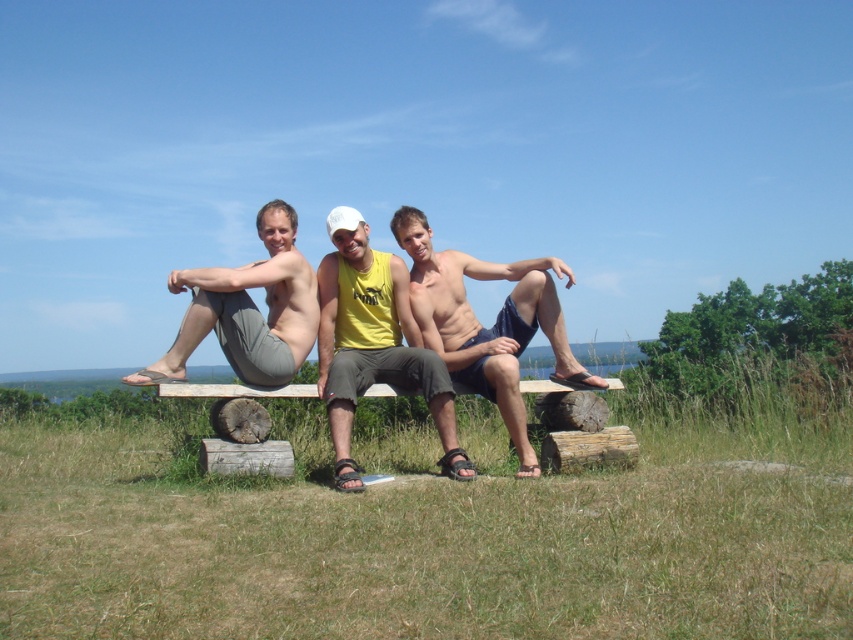
Question: Considering the relative positions of matte blue shorts at center and matte gray pants at center in the image provided, where is matte blue shorts at center located with respect to matte gray pants at center?

Choices:
 (A) left
 (B) right

Answer: (B)

Question: Is yellow matte tank top at center thinner than matte gray pants at center?

Choices:
 (A) no
 (B) yes

Answer: (B)

Question: Is matte blue shorts at center thinner than matte gray pants at center?

Choices:
 (A) yes
 (B) no

Answer: (B)

Question: Which point is farther to the camera?

Choices:
 (A) [x=334, y=232]
 (B) [x=531, y=260]

Answer: (B)

Question: Estimate the real-world distances between objects in this image. Which object is farther from the matte blue shorts at center?

Choices:
 (A) matte gray pants at center
 (B) yellow matte tank top at center

Answer: (A)

Question: Which point appears farthest from the camera in this image?

Choices:
 (A) (534, 461)
 (B) (386, 344)

Answer: (B)